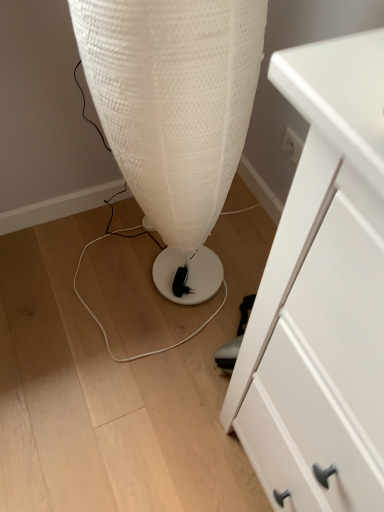
What do you see at coordinates (175, 112) in the screenshot? I see `white mesh lamp at center` at bounding box center [175, 112].

Where is `white mesh lamp at center`? white mesh lamp at center is located at coordinates (175, 112).

Identify the location of white mesh lamp at center. (175, 112).